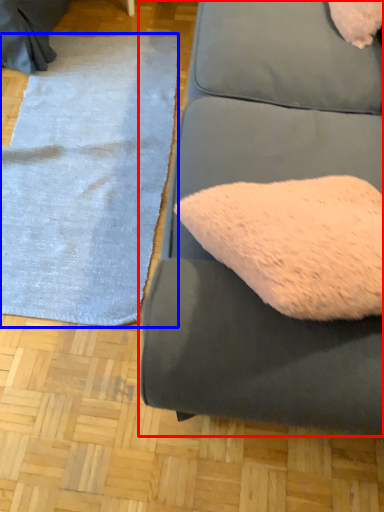
Question: Which object appears closest to the camera in this image, studio couch (highlighted by a red box) or mat (highlighted by a blue box)?

Choices:
 (A) studio couch
 (B) mat

Answer: (A)